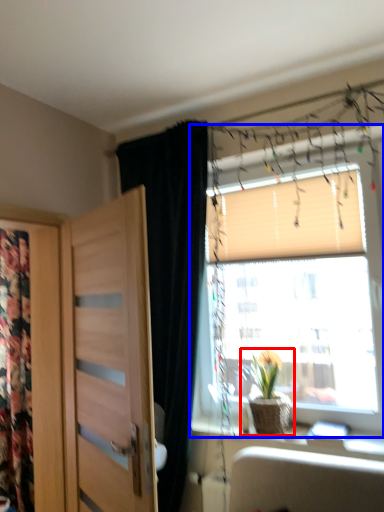
Question: Which object is further to the camera taking this photo, houseplant (highlighted by a red box) or window (highlighted by a blue box)?

Choices:
 (A) houseplant
 (B) window

Answer: (A)